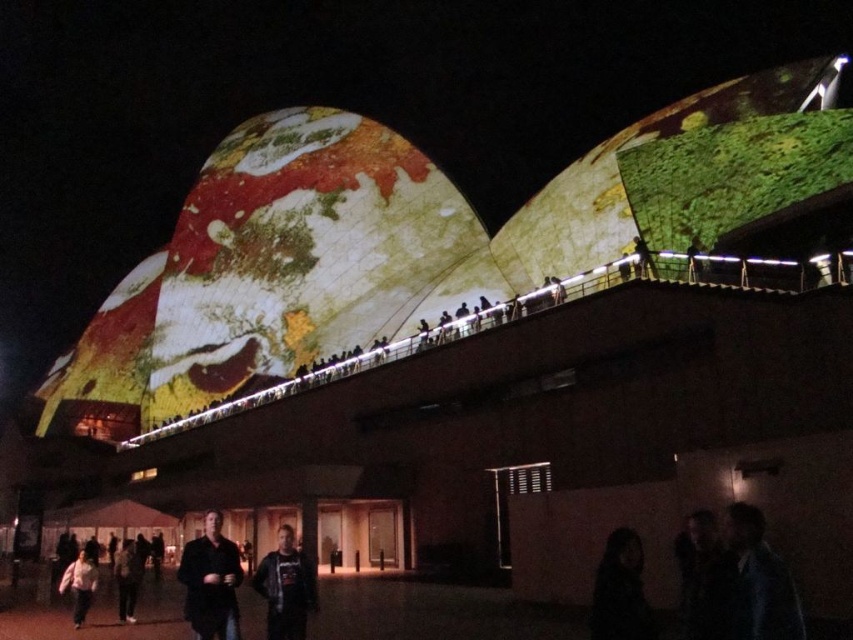
Question: Which point is farther to the camera?

Choices:
 (A) dark gray hoodie at center
 (B) dark brown leather jacket at lower center
 (C) dark hair at lower center

Answer: (B)

Question: Which point appears farthest from the camera in this image?

Choices:
 (A) (71, 586)
 (B) (628, 636)
 (C) (776, 614)
 (D) (292, 547)

Answer: (A)

Question: Does dark blue fabric jacket at lower right have a greater width compared to dark hair at lower center?

Choices:
 (A) no
 (B) yes

Answer: (A)

Question: Among these objects, which one is nearest to the camera?

Choices:
 (A) dark gray hoodie at center
 (B) dark hair at lower center
 (C) dark brown leather jacket at lower center
 (D) dark blue fabric jacket at lower right

Answer: (B)

Question: Is dark brown leather jacket at lower center thinner than dark gray hoodie at center?

Choices:
 (A) no
 (B) yes

Answer: (A)

Question: Is dark gray hoodie at center wider than white matte shirt at lower left?

Choices:
 (A) no
 (B) yes

Answer: (A)